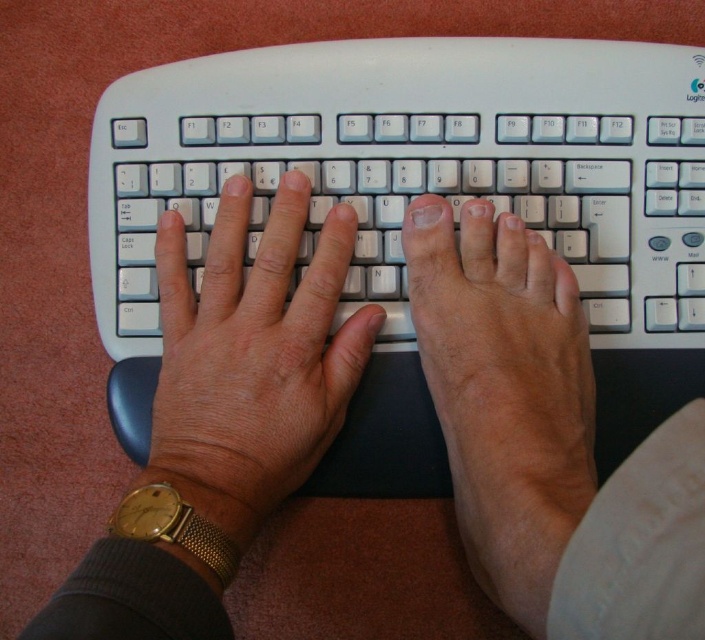
You are trying to place a new mouse next to the white plastic keyboard at center on your desk. According to the coordinates provided, where should you place the mouse relative to the keyboard?

The white plastic keyboard at center is located at point (417, 166). To place the mouse next to it, you should position the mouse near the coordinates provided, ensuring it is adjacent to the keyboard on the desk.

Based on the scene description, where is the matte white foot at center located in terms of coordinates?

The matte white foot at center is located at coordinates point (503, 392).

You are a computer technician trying to fix a keyboard issue. You notice the matte white foot at center and the white matte keyboard at center in the image. Which object is positioned to the right of the other?

The matte white foot at center is to the right of the white matte keyboard at center according to the description.